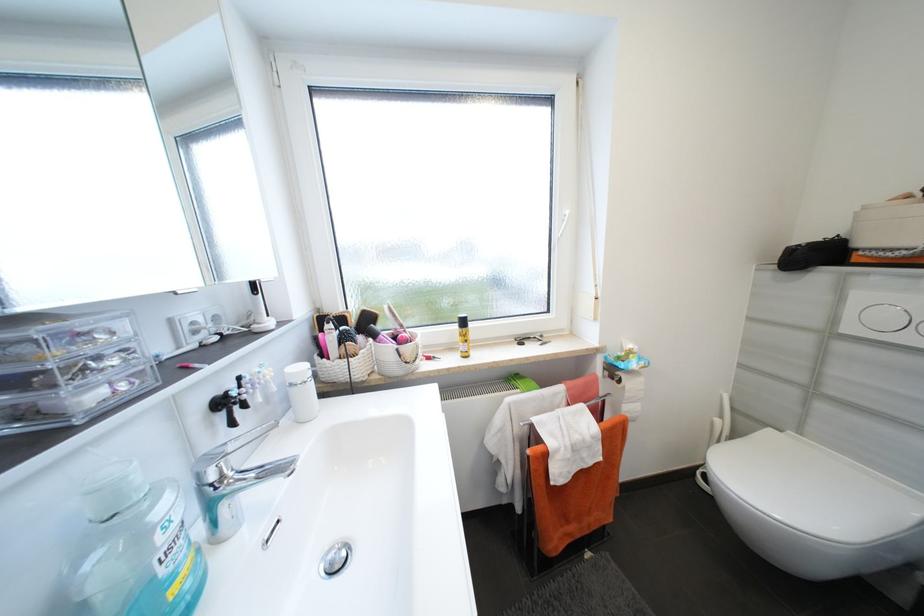
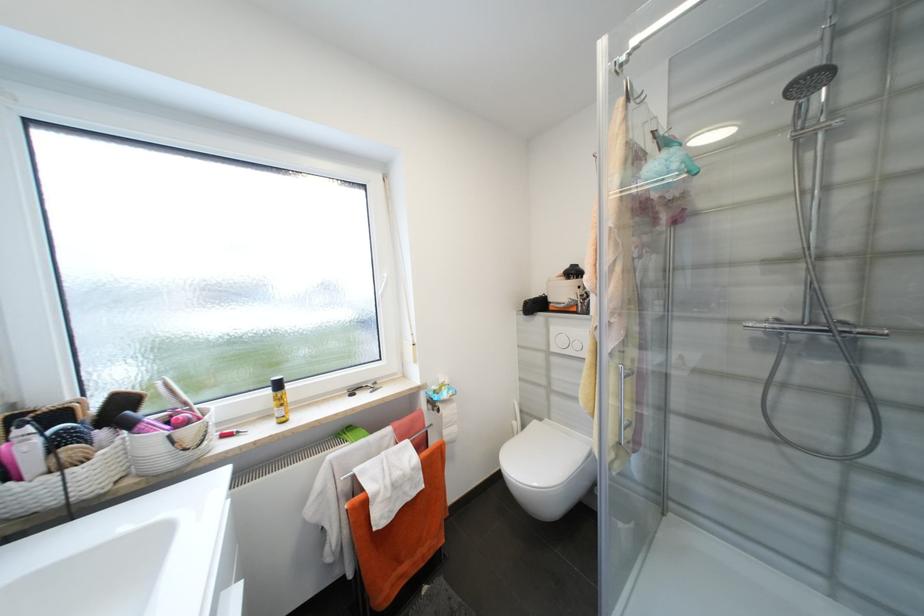
In the second image, find the point that corresponds to (x=469, y=323) in the first image.

(284, 386)